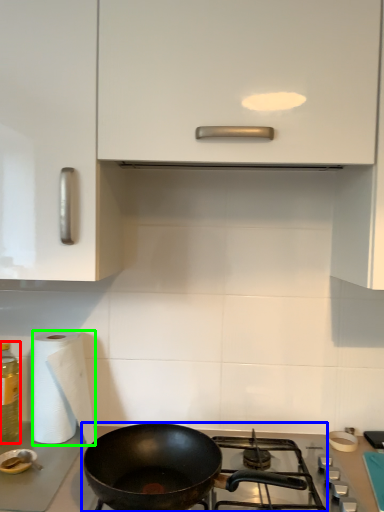
Question: Considering the real-world distances, which object is closest to bottle (highlighted by a red box)? gas stove (highlighted by a blue box) or paper towel (highlighted by a green box).

Choices:
 (A) gas stove
 (B) paper towel

Answer: (B)